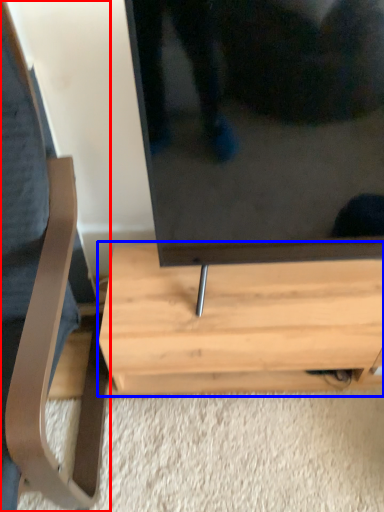
Question: Which point is closer to the camera, furniture (highlighted by a red box) or table (highlighted by a blue box)?

Choices:
 (A) furniture
 (B) table

Answer: (A)